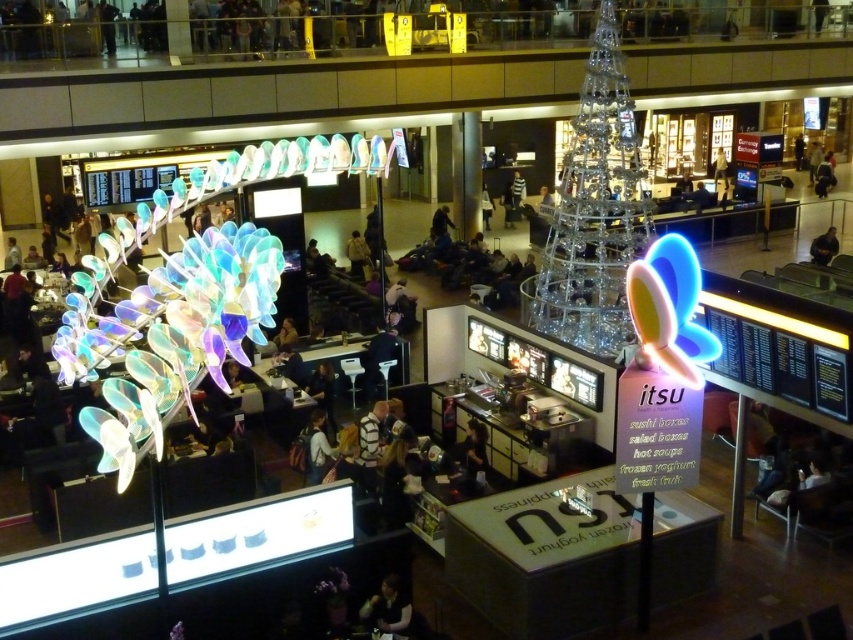
Is black fabric jacket at lower right thinner than matte black jacket at center?

Incorrect, black fabric jacket at lower right's width is not less than matte black jacket at center's.

Is black fabric jacket at lower right positioned in front of matte black jacket at center?

Yes, black fabric jacket at lower right is in front of matte black jacket at center.

Is point (810, 250) less distant than point (717, 161)?

Yes, point (810, 250) is in front of point (717, 161).

Locate an element on the screen. This screenshot has height=640, width=853. black fabric jacket at lower right is located at coordinates (824, 248).

Which is behind, point (596, 237) or point (399, 602)?

The point (596, 237) is behind.

Which is above, clear glass christmas tree at center or dark gray sweater at lower center?

clear glass christmas tree at center is higher up.

Which is in front, point (610, 248) or point (390, 580)?

Point (390, 580) is more forward.

At what (x,y) coordinates should I click in order to perform the action: click on clear glass christmas tree at center. Please return your answer as a coordinate pair (x, y). The image size is (853, 640). Looking at the image, I should click on (595, 211).

Which of these two, dark gray sweater at lower center or black fabric jacket at lower right, stands taller?

black fabric jacket at lower right is taller.

Based on the photo, does dark gray sweater at lower center lie in front of black fabric jacket at lower right?

Yes, dark gray sweater at lower center is in front of black fabric jacket at lower right.

The height and width of the screenshot is (640, 853). What are the coordinates of `dark gray sweater at lower center` in the screenshot? It's located at (387, 608).